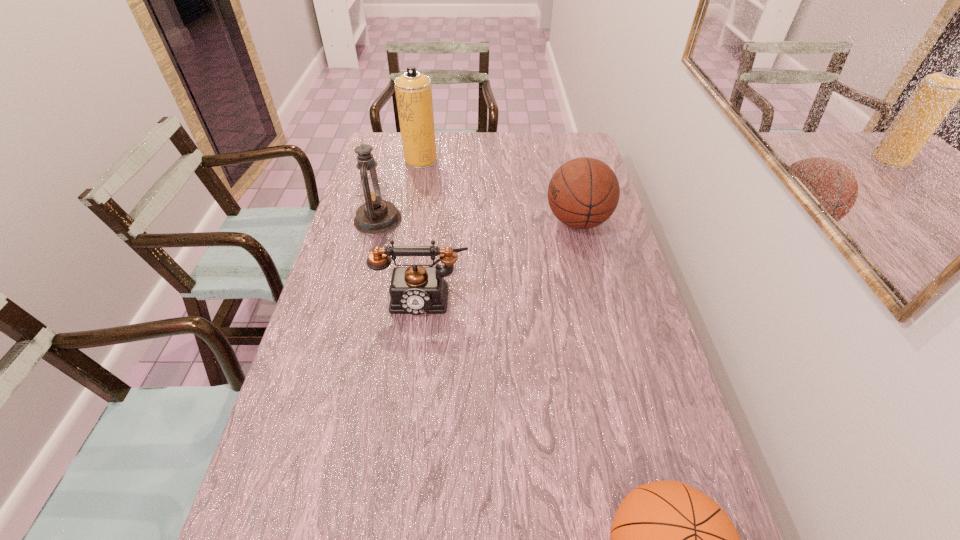
Identify the location of object situated at the far edge. Image resolution: width=960 pixels, height=540 pixels. (413, 90).

Identify the location of aerosol can that is at the left edge. The width and height of the screenshot is (960, 540). (413, 90).

What are the coordinates of `oil lamp positioned at the left edge` in the screenshot? It's located at (376, 216).

Find the location of a particular element. The height and width of the screenshot is (540, 960). telephone that is at the left edge is located at coordinates (416, 290).

Image resolution: width=960 pixels, height=540 pixels. I want to click on object situated at the right edge, so click(584, 192).

Find the location of a particular element. The image size is (960, 540). object situated at the far left corner is located at coordinates (413, 90).

The image size is (960, 540). What are the coordinates of `vacant region at the left edge of the desktop` in the screenshot? It's located at (312, 334).

I want to click on vacant space at the right edge of the desktop, so click(663, 443).

This screenshot has height=540, width=960. Find the location of `vacant region at the far left corner of the desktop`. vacant region at the far left corner of the desktop is located at coordinates (396, 132).

Identify the location of free space between the fourth farthest object and the oil lamp. Image resolution: width=960 pixels, height=540 pixels. (400, 258).